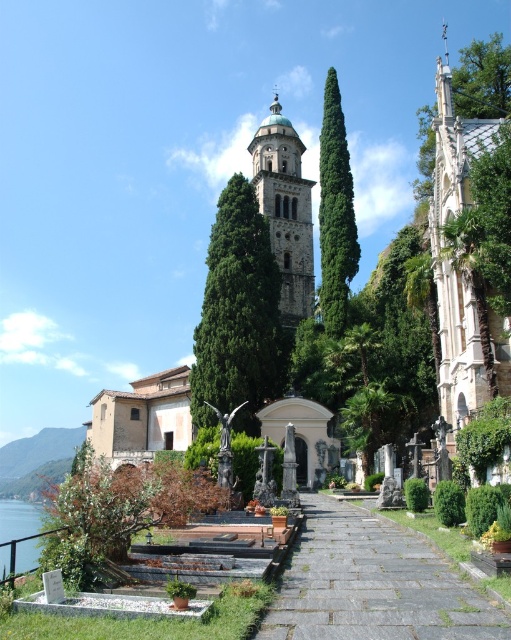
You are standing at the entrance of the cemetery and want to take a photo that includes both point (x=68, y=513) and point (x=16, y=524). Which point will appear larger in your photo?

Point (x=68, y=513) will appear larger in the photo because it is closer to the camera than point (x=16, y=524).